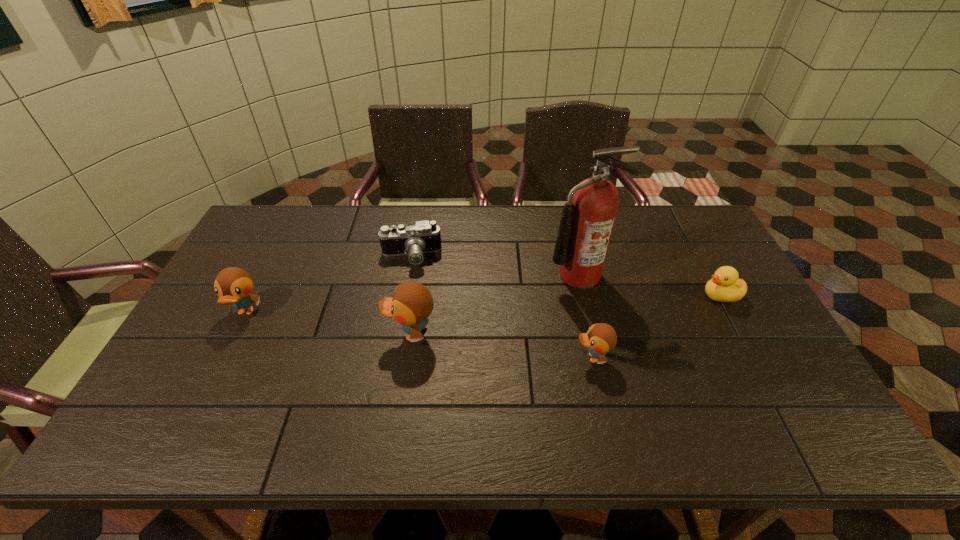
This screenshot has height=540, width=960. I want to click on vacant area between the rightmost object and the leftmost object, so click(x=483, y=304).

This screenshot has width=960, height=540. What are the coordinates of `free spot between the third duck from left to right and the camera` in the screenshot? It's located at (502, 307).

Where is `free space between the camera and the second duck from right to left`? The width and height of the screenshot is (960, 540). free space between the camera and the second duck from right to left is located at coordinates (502, 307).

This screenshot has width=960, height=540. I want to click on unoccupied area between the tallest object and the third duck from left to right, so click(x=586, y=316).

At what (x,y) coordinates should I click in order to perform the action: click on free space between the third tallest object and the camera. Please return your answer as a coordinate pair (x, y). Image resolution: width=960 pixels, height=540 pixels. Looking at the image, I should click on (328, 285).

Locate which object ranks in proximity to the camera. Please provide its 2D coordinates. Your answer should be formatted as a tuple, i.e. [(x, y)], where the tuple contains the x and y coordinates of a point satisfying the conditions above.

[(411, 304)]

Where is `object that is the closest one to the second tallest duck`? Image resolution: width=960 pixels, height=540 pixels. object that is the closest one to the second tallest duck is located at coordinates (414, 239).

The image size is (960, 540). Identify the location of duck that is the second nearest to the second tallest object. (233, 285).

Where is `the closest duck to the second duck from right to left`? the closest duck to the second duck from right to left is located at coordinates (724, 286).

The image size is (960, 540). I want to click on free spot that satisfies the following two spatial constraints: 1. on the front of the tallest object near the operation label; 2. on the front-facing side of the second tallest object, so click(x=592, y=334).